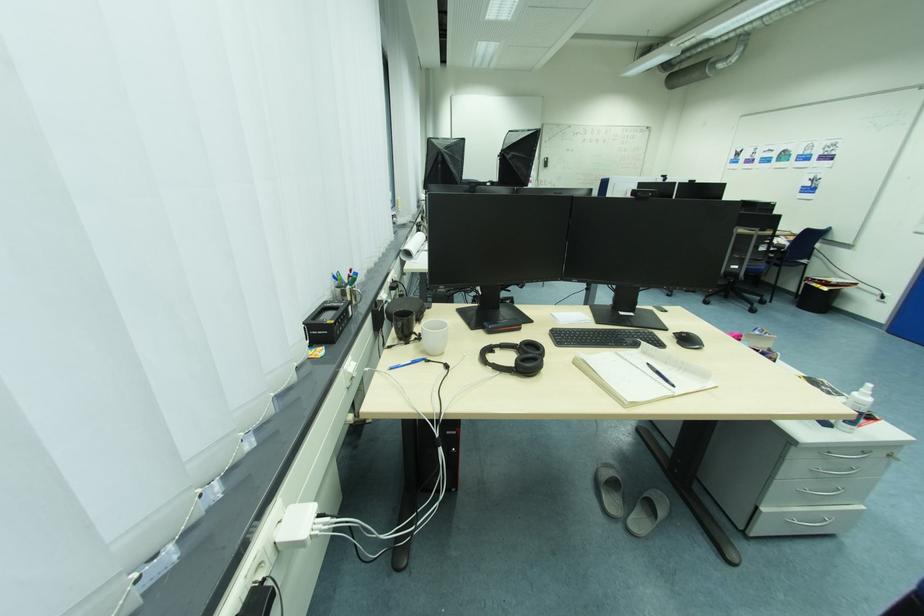
Image resolution: width=924 pixels, height=616 pixels. What do you see at coordinates (791, 254) in the screenshot?
I see `the chair sitting surface` at bounding box center [791, 254].